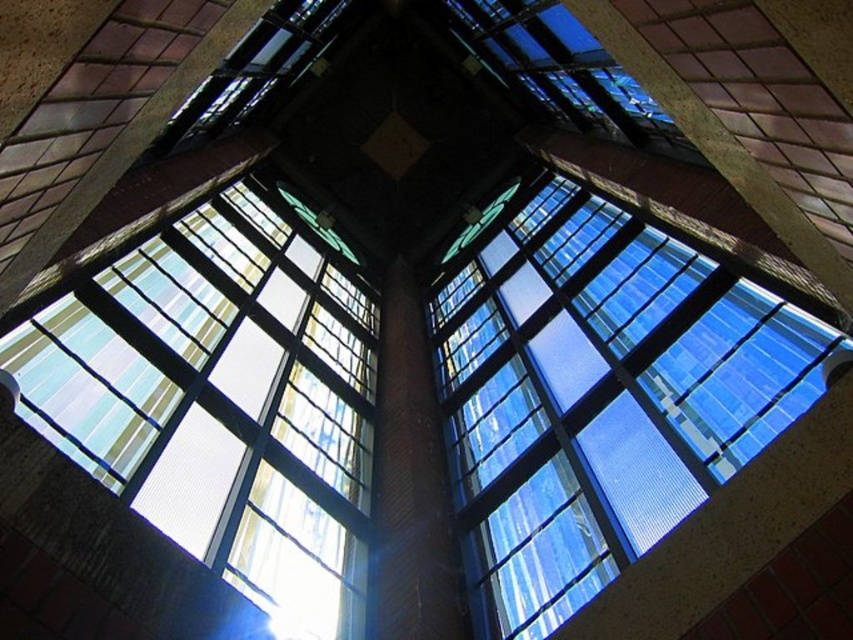
Question: From the image, what is the correct spatial relationship of transparent glass window at upper center in relation to translucent glass window at upper left?

Choices:
 (A) above
 (B) below

Answer: (A)

Question: Among these objects, which one is farthest from the camera?

Choices:
 (A) translucent glass window at upper left
 (B) red brick pillar at center
 (C) transparent glass window at upper center

Answer: (B)

Question: Is transparent glass window at upper center further to the viewer compared to red brick pillar at center?

Choices:
 (A) no
 (B) yes

Answer: (A)

Question: Among these objects, which one is farthest from the camera?

Choices:
 (A) red brick pillar at center
 (B) transparent glass window at upper center

Answer: (A)

Question: Is translucent glass window at upper left to the right of red brick pillar at center from the viewer's perspective?

Choices:
 (A) yes
 (B) no

Answer: (B)

Question: Which of the following is the closest to the observer?

Choices:
 (A) red brick pillar at center
 (B) translucent glass window at upper left
 (C) transparent glass window at upper center

Answer: (C)